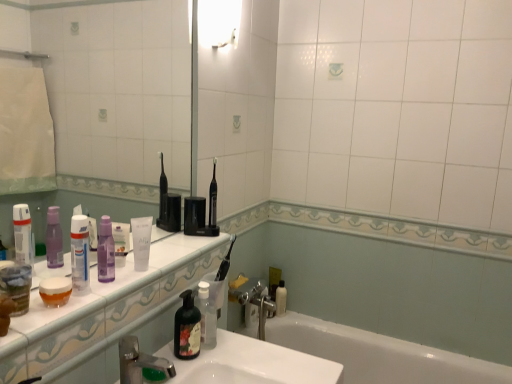
Find the location of `vacant space in front of translucent plastic jar at lower left, which ranks as the first mouthwash in bottom-to-top order`. vacant space in front of translucent plastic jar at lower left, which ranks as the first mouthwash in bottom-to-top order is located at coordinates (35, 326).